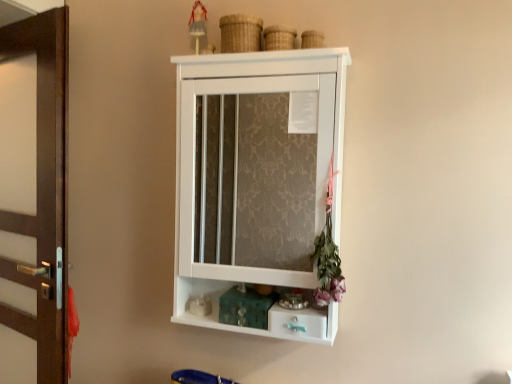
Question: Does teal glossy drawer at lower center have a lesser width compared to white matte figurine at lower center, placed as the 2th toy when sorted from top to bottom?

Choices:
 (A) no
 (B) yes

Answer: (A)

Question: Is teal glossy drawer at lower center at the right side of white matte figurine at lower center, placed as the 2th toy when sorted from top to bottom?

Choices:
 (A) yes
 (B) no

Answer: (A)

Question: Does teal glossy drawer at lower center come behind white matte figurine at lower center, placed as the 2th toy when sorted from top to bottom?

Choices:
 (A) no
 (B) yes

Answer: (A)

Question: Considering the relative sizes of teal glossy drawer at lower center and white matte figurine at lower center, the first toy positioned from the bottom, in the image provided, is teal glossy drawer at lower center taller than white matte figurine at lower center, the first toy positioned from the bottom,?

Choices:
 (A) yes
 (B) no

Answer: (B)

Question: Considering the relative sizes of teal glossy drawer at lower center and white matte figurine at lower center, the first toy positioned from the bottom, in the image provided, is teal glossy drawer at lower center wider than white matte figurine at lower center, the first toy positioned from the bottom,?

Choices:
 (A) no
 (B) yes

Answer: (B)

Question: Is white matte cabinet at center inside or outside of purple fabric flower at right?

Choices:
 (A) inside
 (B) outside

Answer: (B)

Question: From the image's perspective, is white matte cabinet at center positioned above or below purple fabric flower at right?

Choices:
 (A) below
 (B) above

Answer: (B)

Question: Is point (221, 119) positioned closer to the camera than point (327, 283)?

Choices:
 (A) farther
 (B) closer

Answer: (A)

Question: In the image, is white matte cabinet at center positioned in front of or behind purple fabric flower at right?

Choices:
 (A) front
 (B) behind

Answer: (B)

Question: Considering their positions, is matte plastic doll at upper center, acting as the first toy starting from the top, located in front of or behind purple fabric flower at right?

Choices:
 (A) behind
 (B) front

Answer: (A)

Question: From the image's perspective, is matte plastic doll at upper center, acting as the first toy starting from the top, located above or below purple fabric flower at right?

Choices:
 (A) above
 (B) below

Answer: (A)

Question: Considering the positions of matte plastic doll at upper center, the second toy when ordered from bottom to top, and purple fabric flower at right in the image, is matte plastic doll at upper center, the second toy when ordered from bottom to top, taller or shorter than purple fabric flower at right?

Choices:
 (A) short
 (B) tall

Answer: (A)

Question: Would you say matte plastic doll at upper center, acting as the first toy starting from the top, is to the left or to the right of purple fabric flower at right in the picture?

Choices:
 (A) left
 (B) right

Answer: (A)

Question: Based on their positions, is teal glossy drawer at lower center located to the left or right of brown wood door at left?

Choices:
 (A) left
 (B) right

Answer: (B)

Question: Is teal glossy drawer at lower center wider or thinner than brown wood door at left?

Choices:
 (A) thin
 (B) wide

Answer: (B)